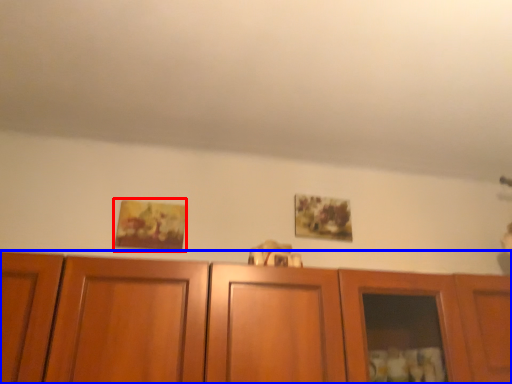
Question: Which point is further to the camera, picture frame (highlighted by a red box) or cabinetry (highlighted by a blue box)?

Choices:
 (A) picture frame
 (B) cabinetry

Answer: (A)